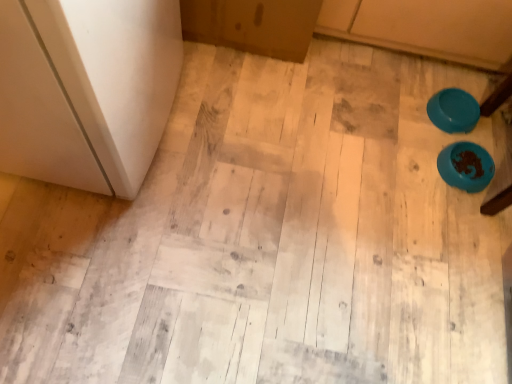
Locate an element on the screen. The width and height of the screenshot is (512, 384). free space in front of teal glossy bowl at upper right, which is the first bowl from top to bottom is located at coordinates (432, 150).